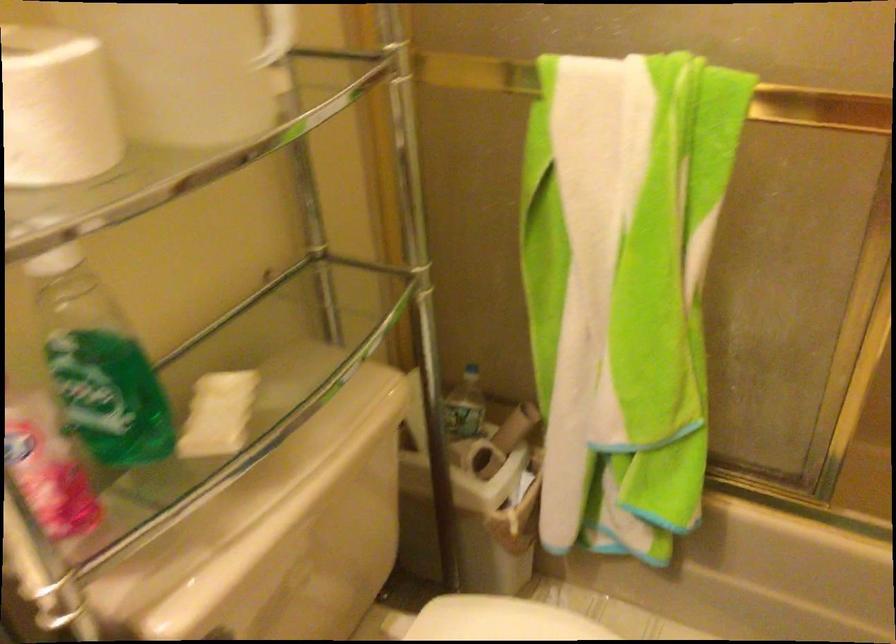
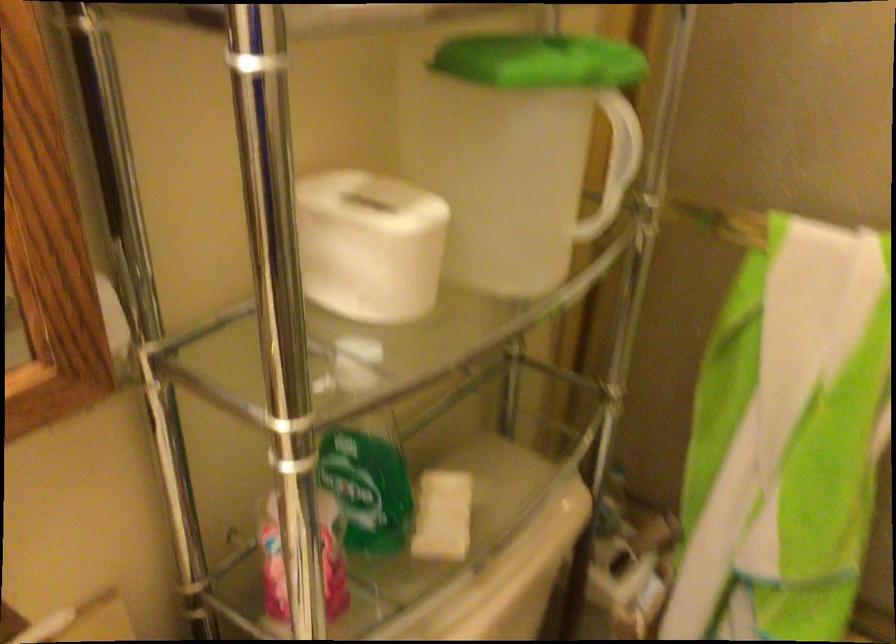
Where in the second image is the point corresponding to point 213,415 from the first image?

(442, 516)